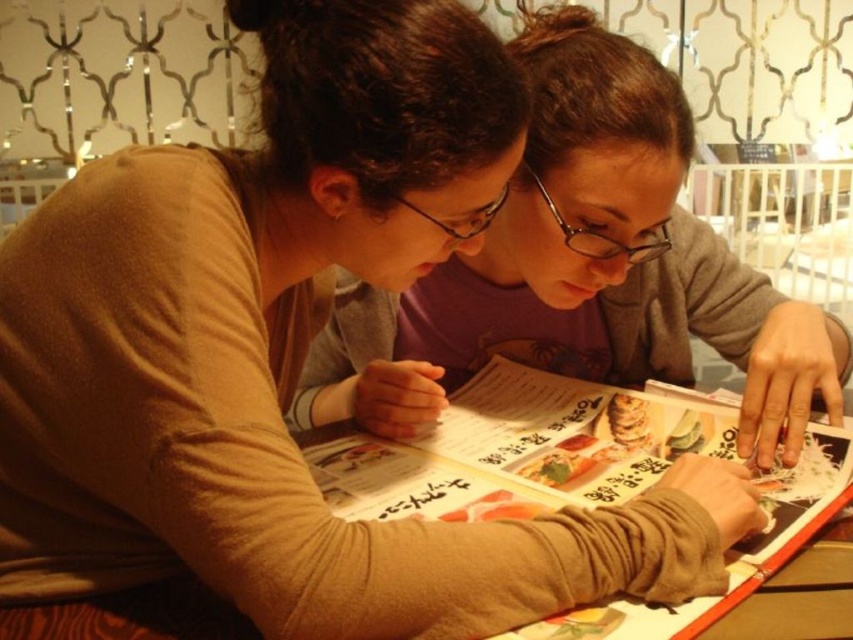
Question: Can you confirm if matte gray sweater at center is bigger than printed paper menu at center?

Choices:
 (A) yes
 (B) no

Answer: (A)

Question: Does matte gray sweater at center have a larger size compared to printed paper menu at center?

Choices:
 (A) no
 (B) yes

Answer: (B)

Question: Which of the following is the farthest from the observer?

Choices:
 (A) matte gray sweater at center
 (B) printed paper menu at center

Answer: (A)

Question: Which of the following is the closest to the observer?

Choices:
 (A) (782, 330)
 (B) (393, 465)

Answer: (B)

Question: Does matte gray sweater at center appear on the left side of printed paper menu at center?

Choices:
 (A) no
 (B) yes

Answer: (B)